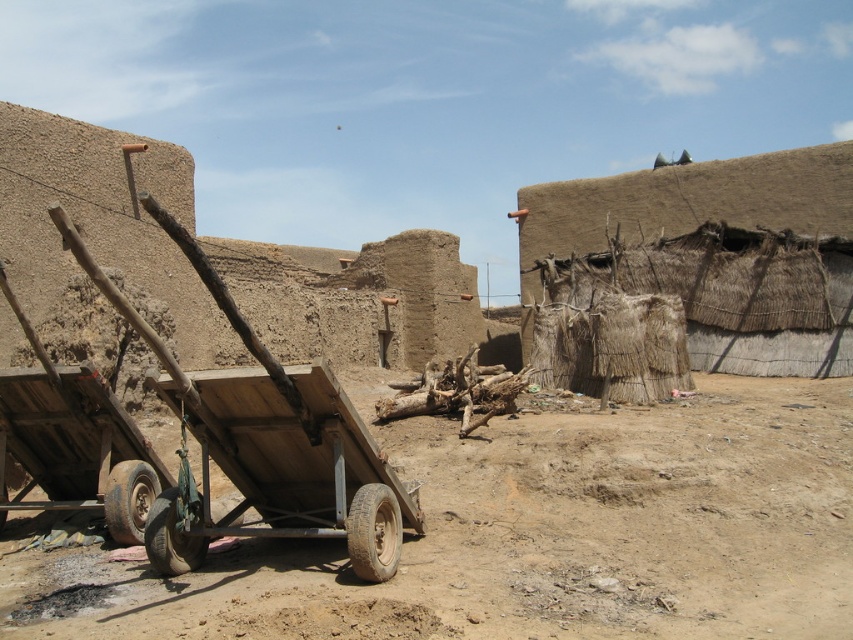
Is brown sandy dirt at lower left positioned behind wooden wagon at center?

No, brown sandy dirt at lower left is in front of wooden wagon at center.

Is brown sandy dirt at lower left taller than wooden wagon at center?

In fact, brown sandy dirt at lower left may be shorter than wooden wagon at center.

Locate an element on the screen. The image size is (853, 640). brown sandy dirt at lower left is located at coordinates (538, 532).